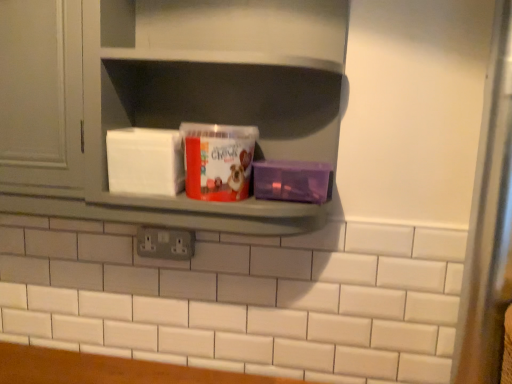
What do you see at coordinates (165, 243) in the screenshot?
I see `gray plastic electric outlet at center` at bounding box center [165, 243].

What is the approximate height of purple plastic container at right?

3.47 inches.

Identify the location of matte gray cabinet at upper left. (41, 97).

Who is bigger, gray plastic electric outlet at center or purple plastic container at right?

purple plastic container at right is bigger.

Which is nearer, (139, 227) or (321, 187)?

The point (321, 187) is closer.

Image resolution: width=512 pixels, height=384 pixels. I want to click on electric outlet to the left of purple plastic container at right, so click(x=165, y=243).

Is purple plastic container at right completely or partially inside gray plastic electric outlet at center?

No, purple plastic container at right is located outside of gray plastic electric outlet at center.

Where is `yoghurt below the matte gray shelf at center (from a real-world perspective)`? yoghurt below the matte gray shelf at center (from a real-world perspective) is located at coordinates tap(218, 161).

Would you say matte plastic tub at center is inside or outside matte gray shelf at center?

matte plastic tub at center is spatially positioned inside matte gray shelf at center.

Which is in front, point (191, 173) or point (56, 40)?

The point (56, 40) is closer.

Is matte plastic tub at center positioned far away from matte gray shelf at center?

No, matte plastic tub at center is in close proximity to matte gray shelf at center.

Does point (234, 142) appear closer or farther from the camera than point (490, 144)?

Clearly, point (234, 142) is more distant from the camera than point (490, 144).

From the image's perspective, is matte plastic tub at center located above transparent glass door at right?

Yes, from the image's perspective, matte plastic tub at center is on top of transparent glass door at right.

Considering the sizes of objects matte plastic tub at center and transparent glass door at right in the image provided, who is thinner, matte plastic tub at center or transparent glass door at right?

transparent glass door at right.

Can you tell me how much matte plastic tub at center and transparent glass door at right differ in facing direction?

matte plastic tub at center and transparent glass door at right are facing 0.131 degrees away from each other.

Measure the distance between transparent glass door at right and matte gray shelf at center.

23.01 inches.

Would you say transparent glass door at right is inside or outside matte gray shelf at center?

transparent glass door at right is not inside matte gray shelf at center, it's outside.

From a real-world perspective, is transparent glass door at right physically below matte gray shelf at center?

Yes, from a real-world perspective, transparent glass door at right is beneath matte gray shelf at center.

Consider the image. Is gray plastic electric outlet at center oriented away from matte gray cabinet at upper left?

No, gray plastic electric outlet at center is not facing the opposite direction of matte gray cabinet at upper left.

Looking at this image, considering the sizes of objects gray plastic electric outlet at center and matte gray cabinet at upper left in the image provided, who is wider, gray plastic electric outlet at center or matte gray cabinet at upper left?

matte gray cabinet at upper left is wider.

Measure the distance from gray plastic electric outlet at center to matte gray cabinet at upper left.

gray plastic electric outlet at center and matte gray cabinet at upper left are 13.85 inches apart from each other.

Considering the relative sizes of gray plastic electric outlet at center and matte gray cabinet at upper left in the image provided, is gray plastic electric outlet at center smaller than matte gray cabinet at upper left?

Yes, gray plastic electric outlet at center is smaller than matte gray cabinet at upper left.

Between purple plastic container at right and matte gray cabinet at upper left, which one has less height?

purple plastic container at right.

What are the coordinates of `carton located on the right of matte gray cabinet at upper left` in the screenshot? It's located at (292, 181).

Between purple plastic container at right and matte gray cabinet at upper left, which one is positioned in front?

Positioned in front is matte gray cabinet at upper left.

From the image's perspective, is purple plastic container at right beneath matte gray cabinet at upper left?

Yes.

Where is `shelf that is in front of the matte gray cabinet at upper left`? shelf that is in front of the matte gray cabinet at upper left is located at coordinates (164, 98).

Based on the photo, based on their positions, is matte gray shelf at center located to the left or right of matte gray cabinet at upper left?

matte gray shelf at center is to the right of matte gray cabinet at upper left.

From the image's perspective, is matte gray shelf at center under matte gray cabinet at upper left?

Yes.

You are a GUI agent. You are given a task and a screenshot of the screen. Output one action in this format:
    pyautogui.click(x=<x>, y=<y>)
    Task: Click on the carton located above the gray plastic electric outlet at center (from the image's perspective)
    
    Given the screenshot: What is the action you would take?
    pyautogui.click(x=292, y=181)

You are a GUI agent. You are given a task and a screenshot of the screen. Output one action in this format:
    pyautogui.click(x=<x>, y=<y>)
    Task: Click on the shelf that appears in front of the matte plastic tub at center
    The height and width of the screenshot is (384, 512).
    Given the screenshot: What is the action you would take?
    pyautogui.click(x=164, y=98)

Consider the image. Which object lies further to the anchor point matte gray cabinet at upper left, matte gray shelf at center or gray plastic electric outlet at center?

gray plastic electric outlet at center is further to matte gray cabinet at upper left.

Based on their spatial positions, is matte gray shelf at center or gray plastic electric outlet at center closer to purple plastic container at right?

matte gray shelf at center is positioned closer to the anchor purple plastic container at right.

Based on their spatial positions, is transparent glass door at right or matte plastic tub at center further from purple plastic container at right?

transparent glass door at right lies further to purple plastic container at right than the other object.

Which object lies nearer to the anchor point transparent glass door at right, matte plastic tub at center or purple plastic container at right?

The object closer to transparent glass door at right is purple plastic container at right.

Which object lies nearer to the anchor point purple plastic container at right, matte gray shelf at center or matte gray cabinet at upper left?

matte gray shelf at center is closer to purple plastic container at right.

From the image, which object appears to be farther from matte plastic tub at center, transparent glass door at right or matte gray cabinet at upper left?

Among the two, transparent glass door at right is located further to matte plastic tub at center.

Estimate the real-world distances between objects in this image. Which object is closer to gray plastic electric outlet at center, matte plastic tub at center or purple plastic container at right?

matte plastic tub at center lies closer to gray plastic electric outlet at center than the other object.

From the image, which object appears to be nearer to purple plastic container at right, transparent glass door at right or matte gray cabinet at upper left?

transparent glass door at right lies closer to purple plastic container at right than the other object.

Locate an element on the screen. shelf situated between matte plastic tub at center and purple plastic container at right from left to right is located at coordinates (164, 98).

The width and height of the screenshot is (512, 384). I want to click on carton between gray plastic electric outlet at center and transparent glass door at right from left to right, so click(x=292, y=181).

Identify the location of electric outlet between matte gray cabinet at upper left and purple plastic container at right. This screenshot has height=384, width=512. (165, 243).

Identify the location of yoghurt located between matte gray cabinet at upper left and purple plastic container at right in the left-right direction. Image resolution: width=512 pixels, height=384 pixels. (218, 161).